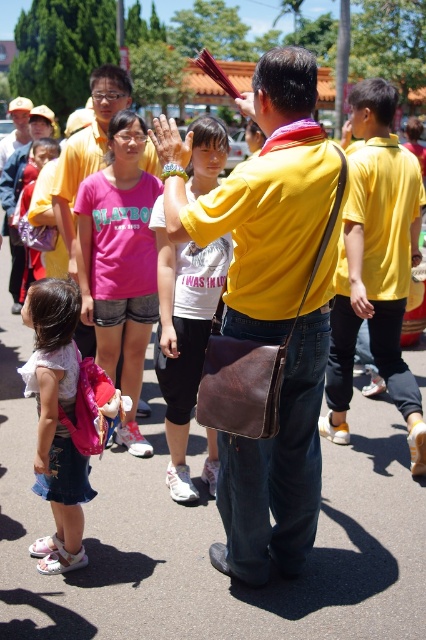
Is point (334, 400) positioned after point (169, 369)?

Yes, it is behind point (169, 369).

Find the location of a particular element. yellow matte shirt at center is located at coordinates 376,266.

Is white cotton t-shirt at center positioned before matte pink backpack at lower left?

No, white cotton t-shirt at center is behind matte pink backpack at lower left.

Describe the element at coordinates (184, 336) in the screenshot. The height and width of the screenshot is (640, 426). I see `white cotton t-shirt at center` at that location.

Locate an element on the screen. The image size is (426, 640). white cotton t-shirt at center is located at coordinates (184, 336).

Is point (377, 365) positioned in front of point (101, 240)?

No, (377, 365) is behind (101, 240).

Is yellow matte shirt at center shorter than pink cotton t-shirt at center?

Incorrect, yellow matte shirt at center's height does not fall short of pink cotton t-shirt at center's.

Is point (354, 260) closer to viewer compared to point (100, 224)?

Yes, point (354, 260) is in front of point (100, 224).

Identify the location of yellow matte shirt at center. This screenshot has height=640, width=426. (376, 266).